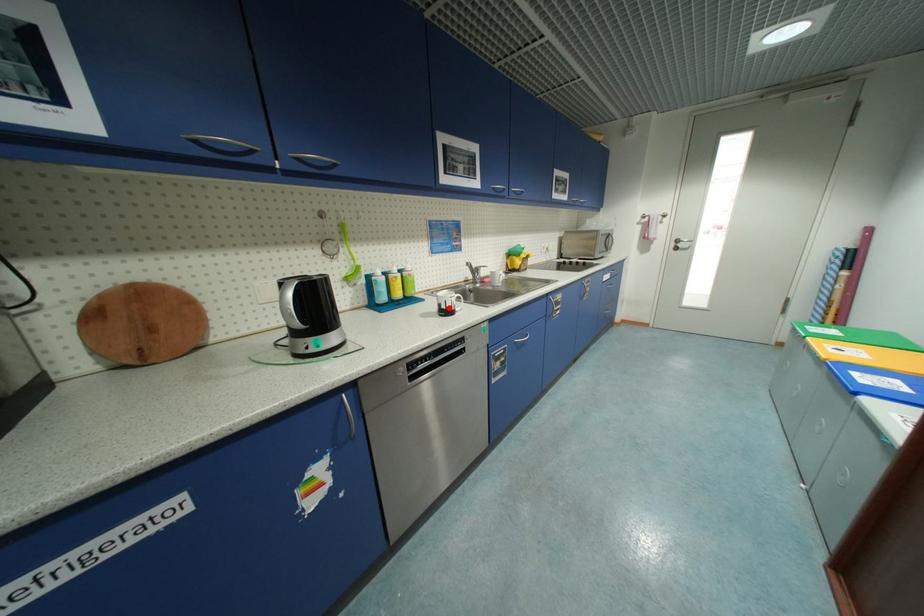
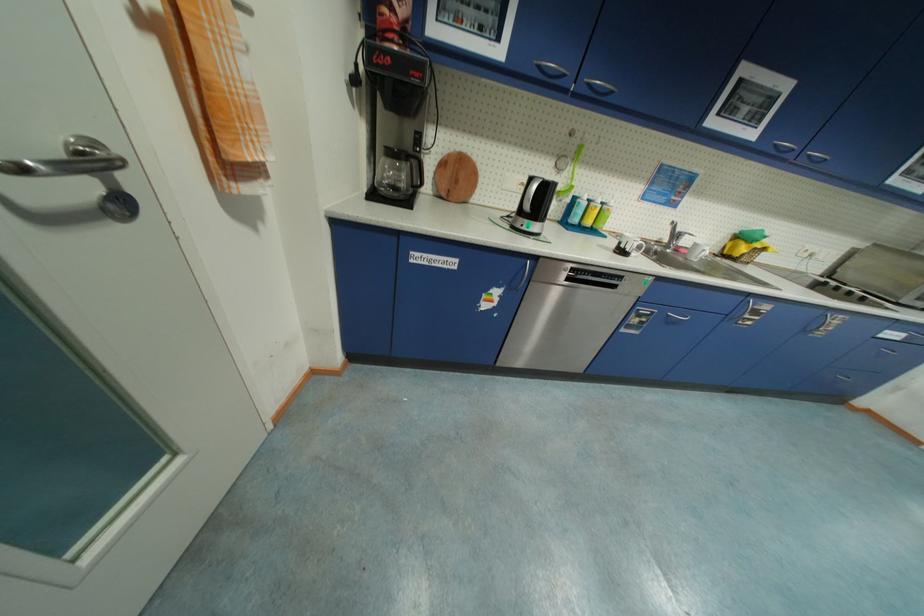
The point at the highlighted location is marked in the first image. Where is the corresponding point in the second image?

(627, 246)